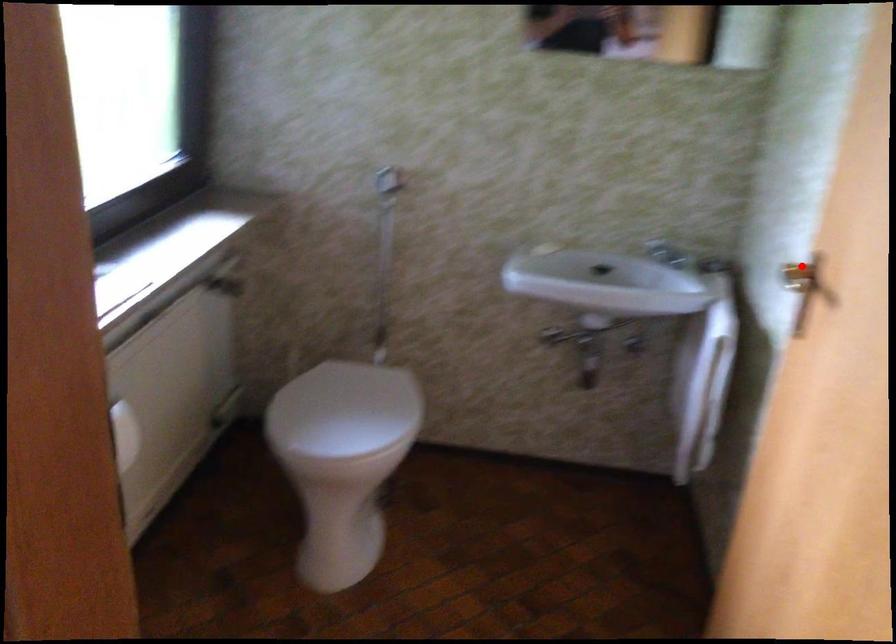
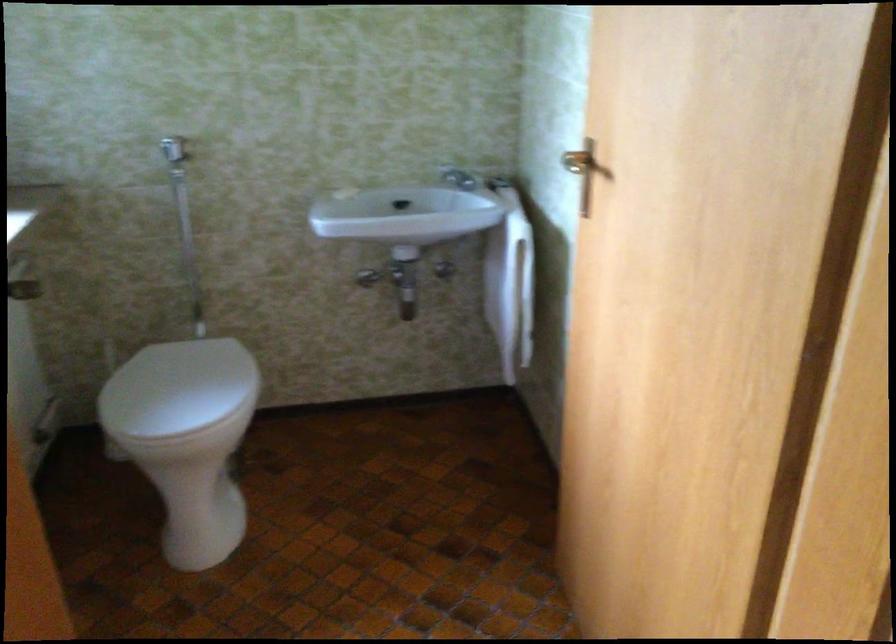
Question: I am providing you with two images of the same scene from different viewpoints. In image1, a red point is highlighted. Considering the same 3D point in image2, which of the following is correct?

Choices:
 (A) It is closer
 (B) It is farther

Answer: (B)